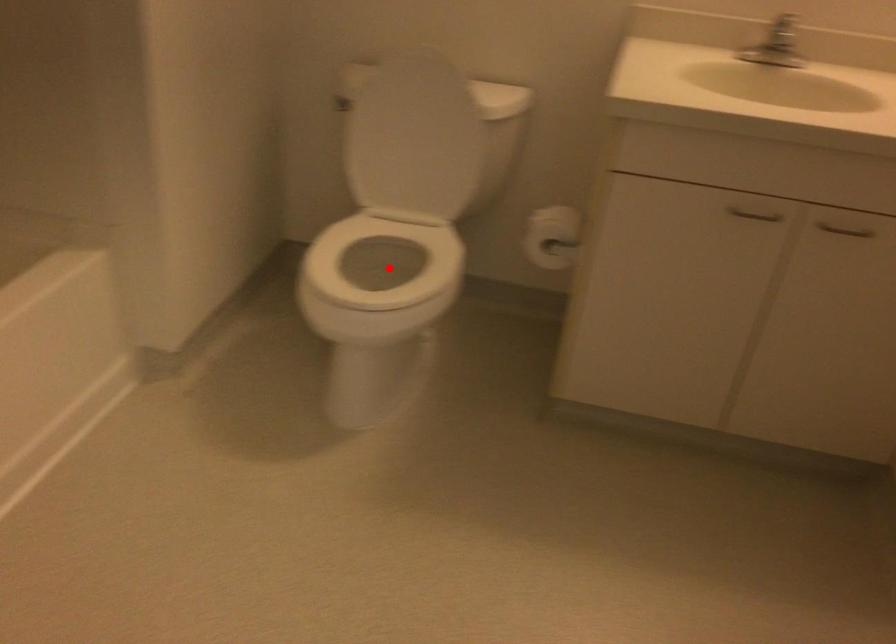
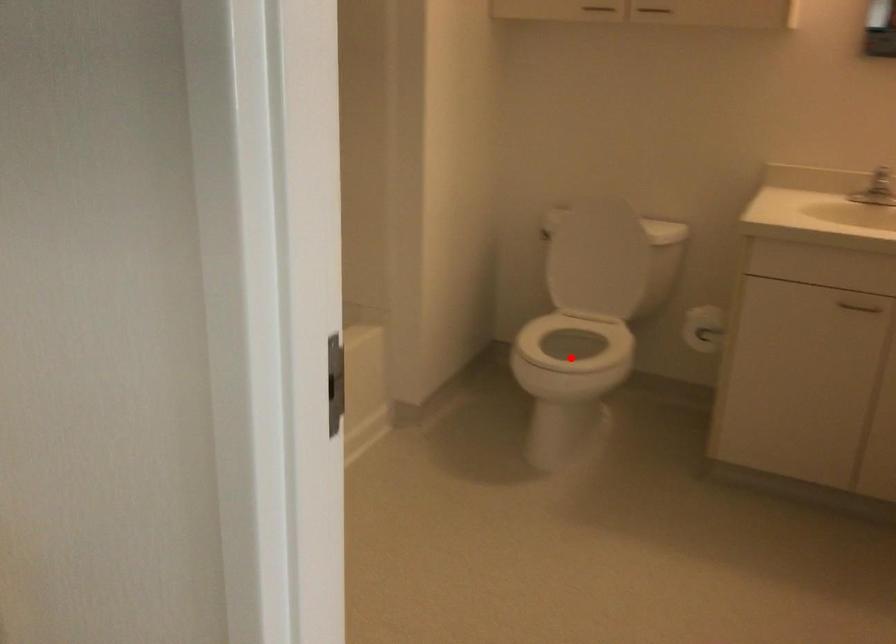
I am providing you with two images of the same scene from different viewpoints. A red point is marked on the first image and another point is marked on the second image. Is the marked point in image1 the same physical position as the marked point in image2?

→ Yes